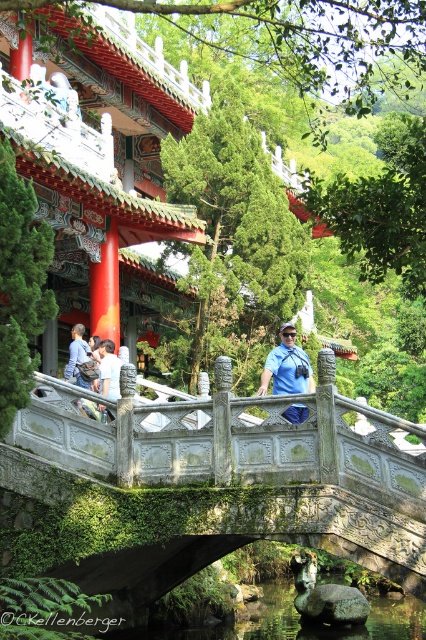
Question: Does clear water at bridge center have a larger size compared to white cotton shirt at center?

Choices:
 (A) no
 (B) yes

Answer: (B)

Question: Which object is closer to the camera taking this photo?

Choices:
 (A) blue fabric shirt at center
 (B) clear water at bridge center

Answer: (A)

Question: Which is nearer to the white cotton shirt at center?

Choices:
 (A) clear water at bridge center
 (B) blue denim jeans at left
 (C) blue fabric shirt at center
 (D) green mossy stone bridge at center

Answer: (B)

Question: Does blue fabric shirt at center have a smaller size compared to blue denim jeans at left?

Choices:
 (A) no
 (B) yes

Answer: (A)

Question: Is clear water at bridge center below blue denim jeans at left?

Choices:
 (A) no
 (B) yes

Answer: (B)

Question: Which point is farther to the camera?

Choices:
 (A) (299, 356)
 (B) (80, 353)

Answer: (B)